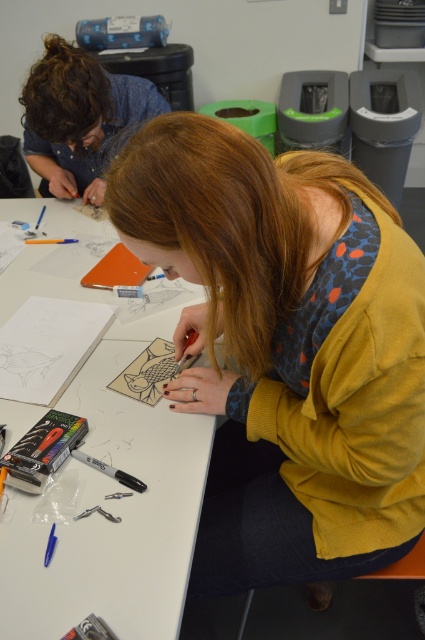
You are an art teacher observing the students in the classroom. You need to check if the curly brown hair at upper left is covering the black matte pen at center. Can you confirm?

The curly brown hair at upper left is positioned over the black matte pen at center, so yes, the curly brown hair at upper left is covering the black matte pen at center.

You are standing in front of the table where the art activity is taking place. There is a point labeled as point (65, 93). What object does this point correspond to?

The point labeled as point (65, 93) corresponds to the curly brown hair at upper left.